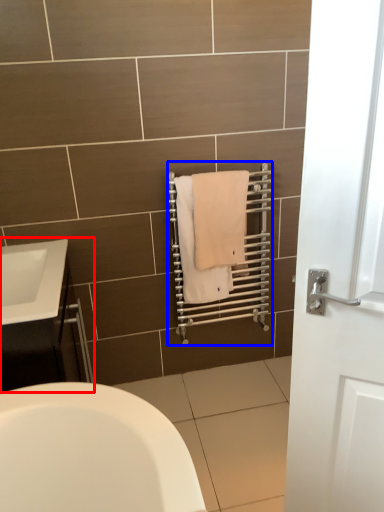
Question: Which of the following is the closest to the observer, bathroom cabinet (highlighted by a red box) or balustrade (highlighted by a blue box)?

Choices:
 (A) bathroom cabinet
 (B) balustrade

Answer: (A)